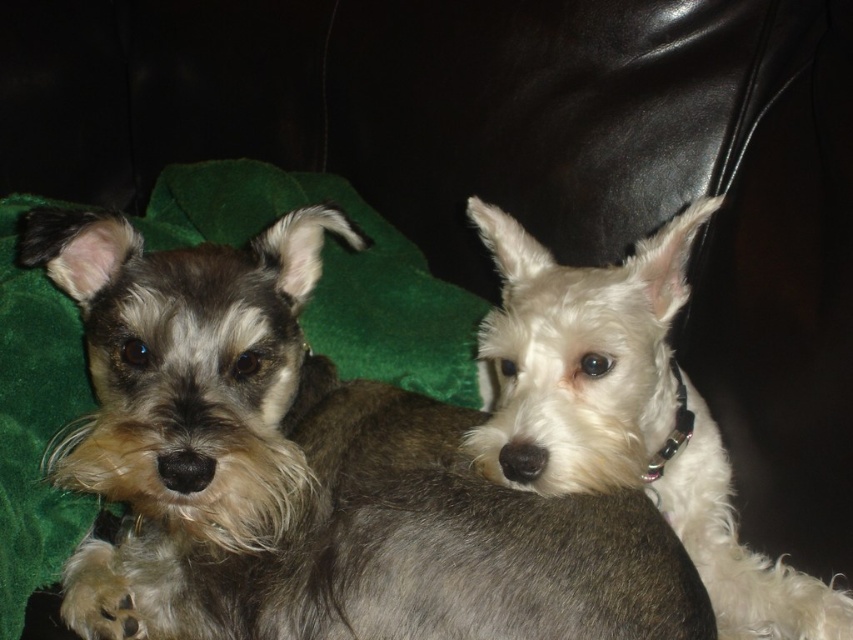
Question: Is the position of gray fur dog at center more distant than that of white fur dog at upper right?

Choices:
 (A) yes
 (B) no

Answer: (B)

Question: Which point appears closest to the camera in this image?

Choices:
 (A) (663, 483)
 (B) (161, 522)

Answer: (B)

Question: Is gray fur dog at center closer to the viewer compared to white fur dog at upper right?

Choices:
 (A) no
 (B) yes

Answer: (B)

Question: Is gray fur dog at center thinner than white fur dog at upper right?

Choices:
 (A) yes
 (B) no

Answer: (B)